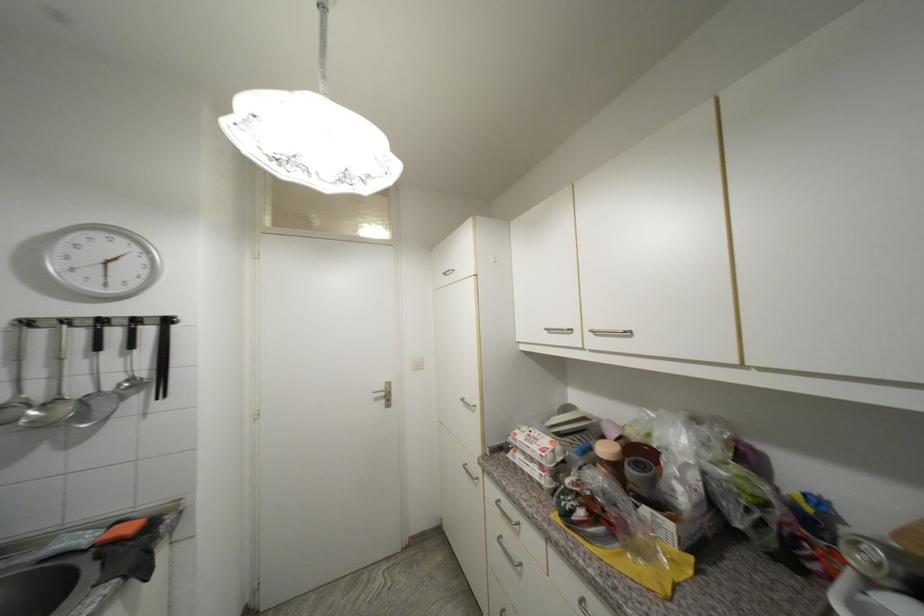
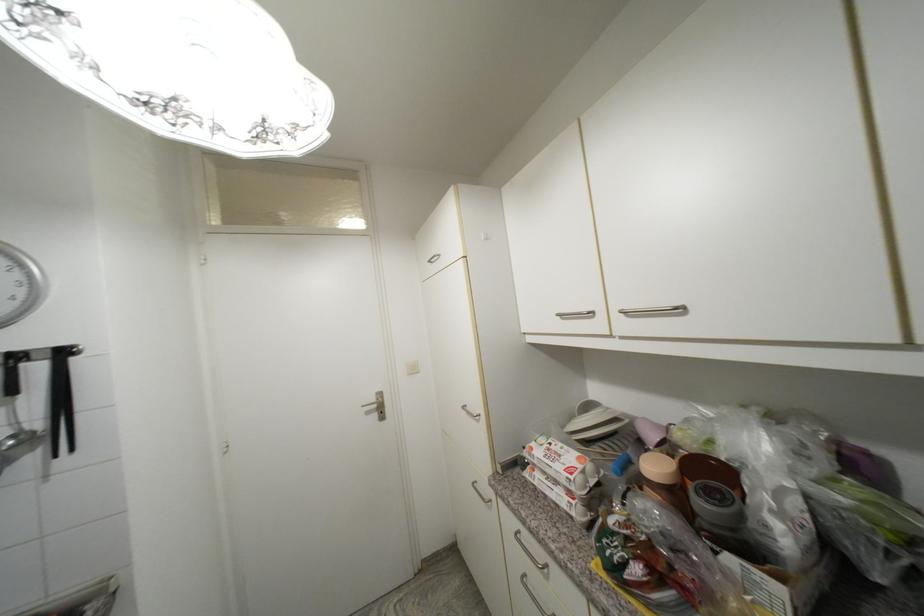
In the second image, find the point that corresponds to the point at 174,323 in the first image.

(69, 354)